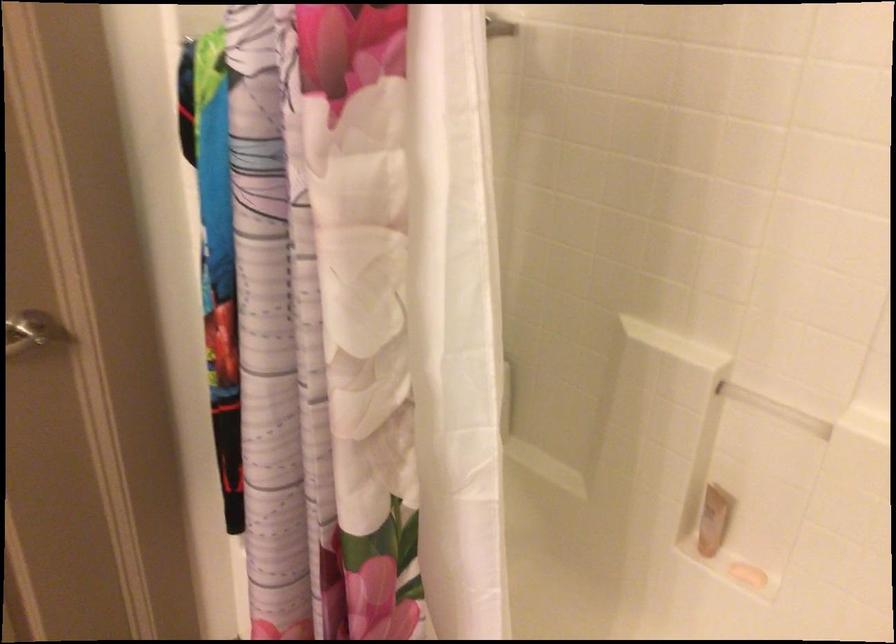
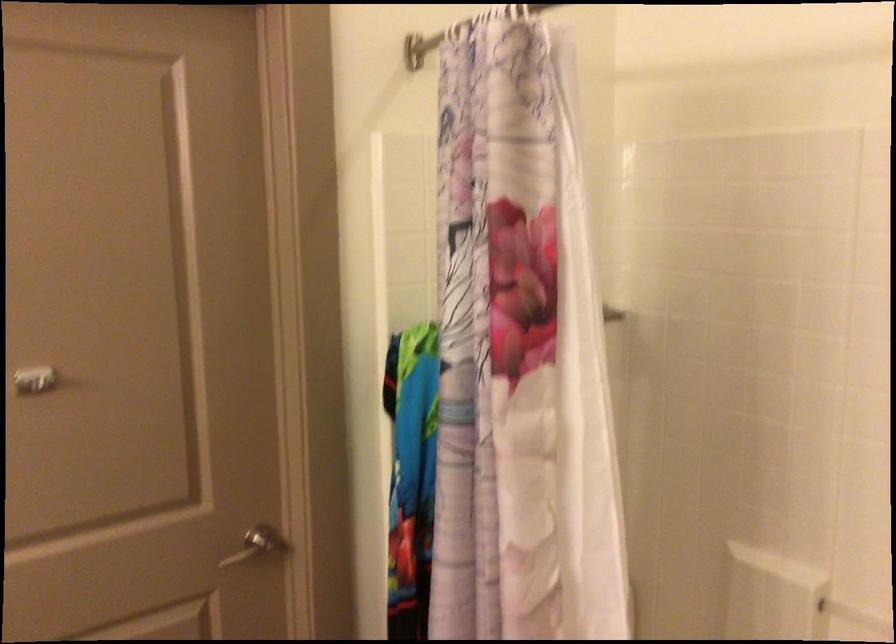
Question: The images are taken continuously from a first-person perspective. In which direction is your viewpoint rotating?

Choices:
 (A) Left
 (B) Right
 (C) Up
 (D) Down

Answer: (C)